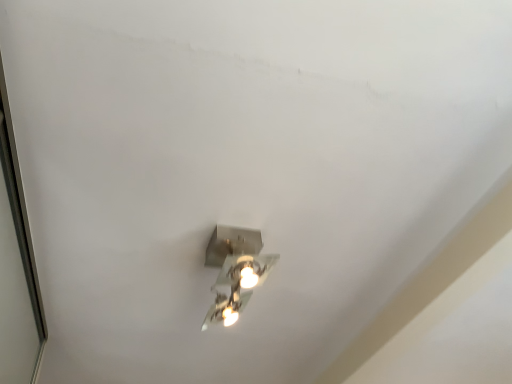
This screenshot has width=512, height=384. Describe the element at coordinates (17, 268) in the screenshot. I see `transparent glass door at left` at that location.

Where is `transparent glass door at left`? The width and height of the screenshot is (512, 384). transparent glass door at left is located at coordinates (17, 268).

I want to click on metallic silver light fixture at center, so click(234, 270).

The height and width of the screenshot is (384, 512). What do you see at coordinates (234, 270) in the screenshot?
I see `metallic silver light fixture at center` at bounding box center [234, 270].

The height and width of the screenshot is (384, 512). I want to click on transparent glass door at left, so click(17, 268).

Considering the relative positions of transparent glass door at left and metallic silver light fixture at center in the image provided, is transparent glass door at left to the left of metallic silver light fixture at center from the viewer's perspective?

Indeed, transparent glass door at left is positioned on the left side of metallic silver light fixture at center.

Relative to metallic silver light fixture at center, is transparent glass door at left in front or behind?

In the image, transparent glass door at left appears in front of metallic silver light fixture at center.

Is point (7, 328) in front of point (268, 255)?

No, (7, 328) is further to viewer.

From the image's perspective, does transparent glass door at left appear lower than metallic silver light fixture at center?

Indeed, from the image's perspective, transparent glass door at left is shown beneath metallic silver light fixture at center.

From a real-world perspective, which object stands above the other?

In real-world perspective, metallic silver light fixture at center is above.

Considering the relative sizes of transparent glass door at left and metallic silver light fixture at center in the image provided, is transparent glass door at left wider than metallic silver light fixture at center?

In fact, transparent glass door at left might be narrower than metallic silver light fixture at center.

Between transparent glass door at left and metallic silver light fixture at center, which one has less height?

With less height is metallic silver light fixture at center.

Considering the sizes of objects transparent glass door at left and metallic silver light fixture at center in the image provided, who is smaller, transparent glass door at left or metallic silver light fixture at center?

metallic silver light fixture at center.

Is transparent glass door at left inside or outside of metallic silver light fixture at center?

transparent glass door at left is not enclosed by metallic silver light fixture at center.

Are transparent glass door at left and metallic silver light fixture at center located far from each other?

That's not correct — transparent glass door at left is a little close to metallic silver light fixture at center.

Is metallic silver light fixture at center at the back of transparent glass door at left?

No.

How many degrees apart are the facing directions of transparent glass door at left and metallic silver light fixture at center?

They differ by 91.2 degrees in their facing directions.

How distant is transparent glass door at left from metallic silver light fixture at center?

transparent glass door at left is 25.23 inches away from metallic silver light fixture at center.

Where is `glass door below the metallic silver light fixture at center (from a real-world perspective)`? The width and height of the screenshot is (512, 384). glass door below the metallic silver light fixture at center (from a real-world perspective) is located at coordinates (17, 268).

Is metallic silver light fixture at center to the left of transparent glass door at left from the viewer's perspective?

Incorrect, metallic silver light fixture at center is not on the left side of transparent glass door at left.

Consider the image. Who is more distant, metallic silver light fixture at center or transparent glass door at left?

metallic silver light fixture at center is further away from the camera.

Is point (258, 269) closer to viewer compared to point (18, 249)?

Yes, it is.

From the image's perspective, is metallic silver light fixture at center located above transparent glass door at left?

Correct, metallic silver light fixture at center appears higher than transparent glass door at left in the image.

From a real-world perspective, is metallic silver light fixture at center over transparent glass door at left?

Correct, in the physical world, metallic silver light fixture at center is higher than transparent glass door at left.

Between metallic silver light fixture at center and transparent glass door at left, which one has smaller width?

transparent glass door at left is thinner.

Who is taller, metallic silver light fixture at center or transparent glass door at left?

transparent glass door at left.

Does metallic silver light fixture at center have a smaller size compared to transparent glass door at left?

Correct, metallic silver light fixture at center occupies less space than transparent glass door at left.

Does metallic silver light fixture at center contain transparent glass door at left?

No, transparent glass door at left is located outside of metallic silver light fixture at center.

Is the surface of metallic silver light fixture at center in direct contact with transparent glass door at left?

No.

Is metallic silver light fixture at center facing towards transparent glass door at left?

No, metallic silver light fixture at center is not turned towards transparent glass door at left.

Find the location of a particular element. The height and width of the screenshot is (384, 512). lamp lying on the right of transparent glass door at left is located at coordinates (234, 270).

Image resolution: width=512 pixels, height=384 pixels. There is a transparent glass door at left. Find the location of `lamp above it (from a real-world perspective)`. lamp above it (from a real-world perspective) is located at coordinates (234, 270).

Identify the location of glass door that appears below the metallic silver light fixture at center (from the image's perspective). (17, 268).